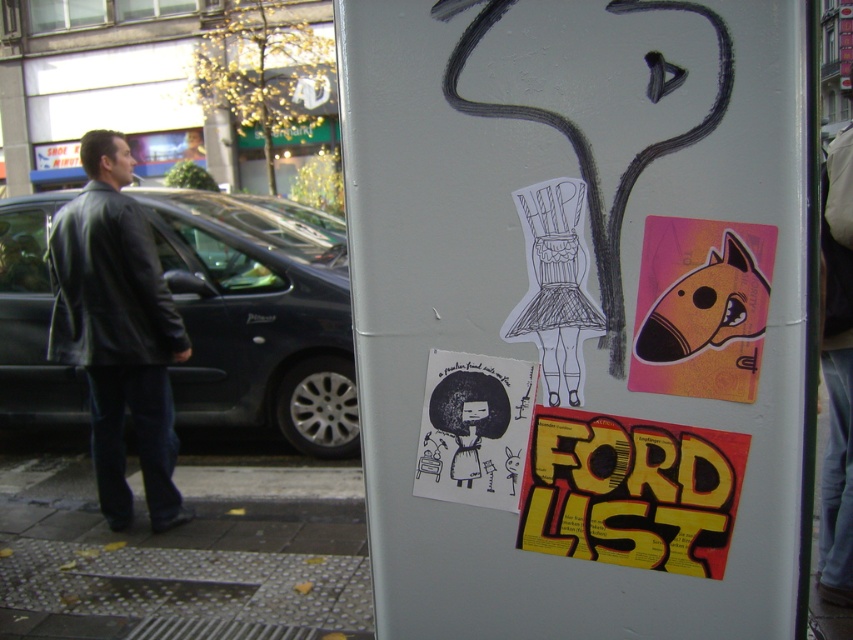
You are a pedestrian looking at the utility pole. You see a black leather jacket at left and a yellow paper poster at center. Which object is higher up on the pole?

The black leather jacket at left is higher up on the pole than the yellow paper poster at center.

Where is the black leather jacket at left located in the image?

The black leather jacket at left is located at point (x=117, y=330) in the image.